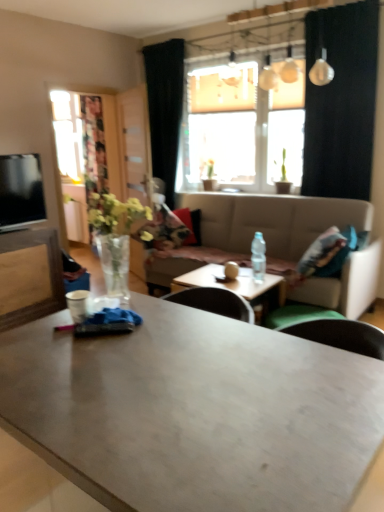
Question: Is beige fabric couch at center to the left of clear glass vase at left from the viewer's perspective?

Choices:
 (A) no
 (B) yes

Answer: (A)

Question: From the image's perspective, is beige fabric couch at center above clear glass vase at left?

Choices:
 (A) yes
 (B) no

Answer: (B)

Question: Is beige fabric couch at center smaller than clear glass vase at left?

Choices:
 (A) yes
 (B) no

Answer: (B)

Question: From a real-world perspective, is beige fabric couch at center located higher than clear glass vase at left?

Choices:
 (A) no
 (B) yes

Answer: (A)

Question: Is the position of beige fabric couch at center more distant than that of clear glass vase at left?

Choices:
 (A) no
 (B) yes

Answer: (B)

Question: Is clear glass vase at left located within beige fabric couch at center?

Choices:
 (A) yes
 (B) no

Answer: (B)

Question: From the image's perspective, would you say matte gray coffee table at center, the 2th coffee table from the back, is positioned over clear plastic bottle at table center?

Choices:
 (A) no
 (B) yes

Answer: (A)

Question: Is matte gray coffee table at center, the 2th coffee table from the back, in front of clear plastic bottle at table center?

Choices:
 (A) no
 (B) yes

Answer: (B)

Question: Is matte gray coffee table at center, which is counted as the first coffee table, starting from the front, outside of clear plastic bottle at table center?

Choices:
 (A) yes
 (B) no

Answer: (A)

Question: Can you confirm if matte gray coffee table at center, which is counted as the first coffee table, starting from the front, is smaller than clear plastic bottle at table center?

Choices:
 (A) yes
 (B) no

Answer: (B)

Question: From a real-world perspective, does matte gray coffee table at center, the 2th coffee table from the back, sit lower than clear plastic bottle at table center?

Choices:
 (A) no
 (B) yes

Answer: (B)

Question: Is matte gray coffee table at center, which is counted as the first coffee table, starting from the front, far away from clear plastic bottle at table center?

Choices:
 (A) yes
 (B) no

Answer: (A)

Question: Is translucent glass window at center bigger than transparent glass door at left?

Choices:
 (A) yes
 (B) no

Answer: (A)